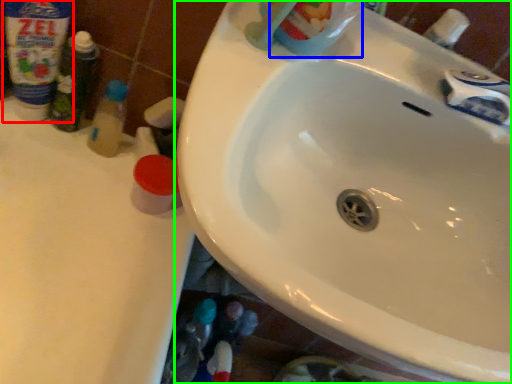
Question: Which object is the farthest from cleaning product (highlighted by a red box)? Choose among these: cleaning product (highlighted by a blue box) or sink (highlighted by a green box).

Choices:
 (A) cleaning product
 (B) sink

Answer: (B)